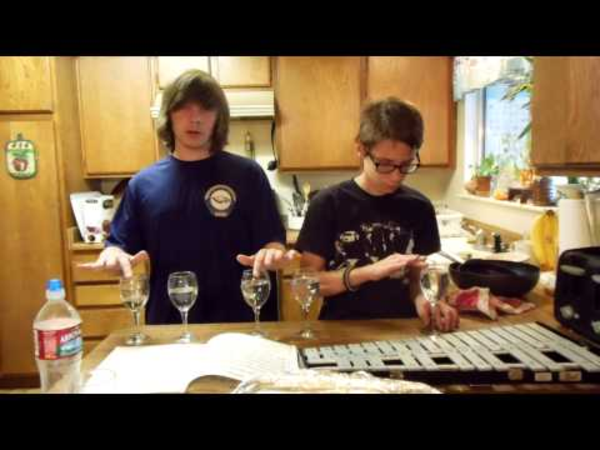
Locate an element on the screen. Image resolution: width=600 pixels, height=450 pixels. window is located at coordinates (495, 115).